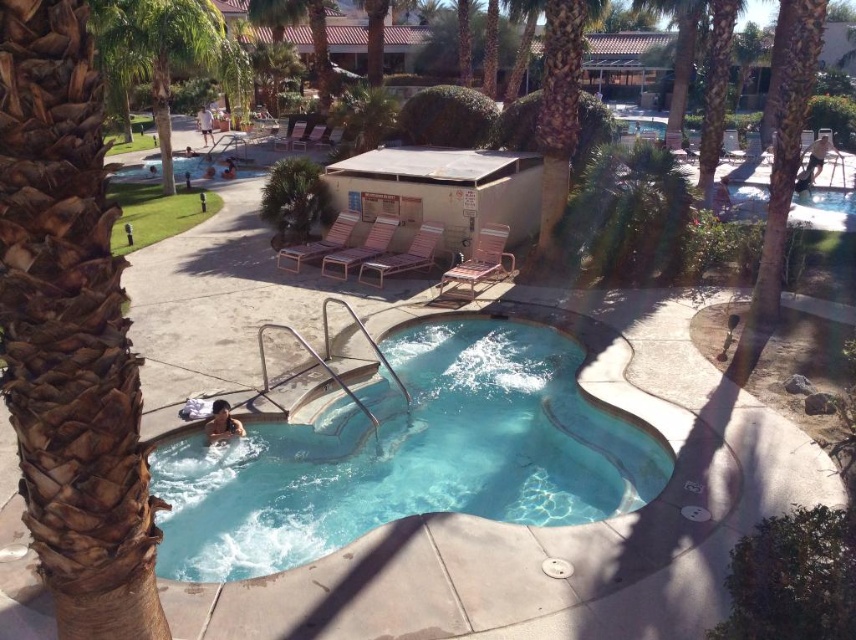
You are planning to take a photo of the smooth skin person at lower left and the brown textured palm tree at center. Which object should you focus on first if you want to capture both in the same frame without zooming in or out?

The brown textured palm tree at center is wider than the smooth skin person at lower left, so you should focus on the brown textured palm tree at center first to ensure both fit in the frame.

You are standing at the edge of the pool and want to jump into the clear blue water at center. Based on the coordinates provided, is the water directly in front of you or to your side?

The clear blue water at center is located at coordinates point (409, 456), which means it is directly in front of you when standing at the edge of the pool.